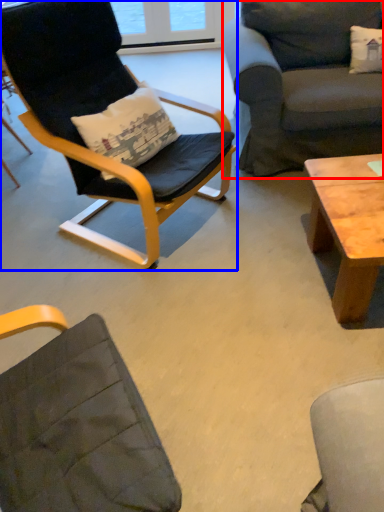
Question: Which object is closer to the camera taking this photo, studio couch (highlighted by a red box) or chair (highlighted by a blue box)?

Choices:
 (A) studio couch
 (B) chair

Answer: (B)